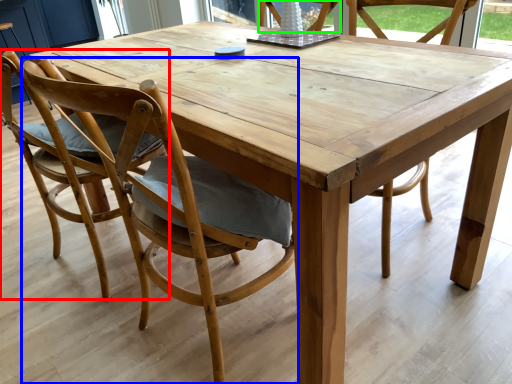
Question: Which object is positioned farthest from chair (highlighted by a red box)? Select from chair (highlighted by a blue box) and chair (highlighted by a green box).

Choices:
 (A) chair
 (B) chair

Answer: (B)